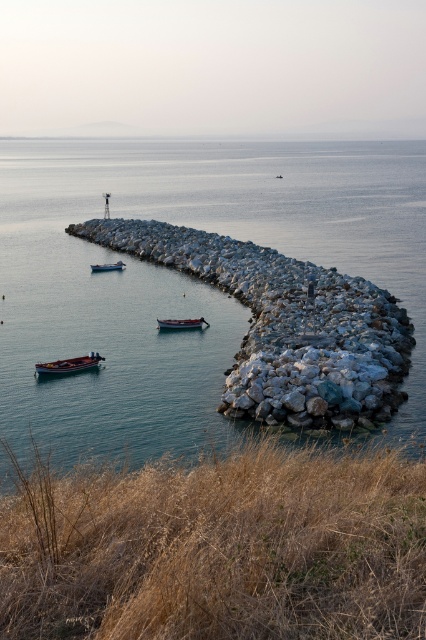
You are standing on the jetty and want to walk towards the wooden boat at lower left. Which direction should you go from the dry grass at lower center?

You should walk to the left from the dry grass at lower center because the wooden boat at lower left is to the left of the dry grass at lower center.

You are a marine biologist planning to deploy a sensor buoy in the clear blue water at center. The buoy requires a minimum of 50 meters of distance from any boat to avoid interference. Is the wooden boat at center currently within the required safety distance?

The clear blue water at center and wooden boat at center are 43.68 meters apart from each other. Since 43.68 meters is less than the required 50 meters, the wooden boat at center is too close to the clear blue water at center for the sensor buoy deployment.